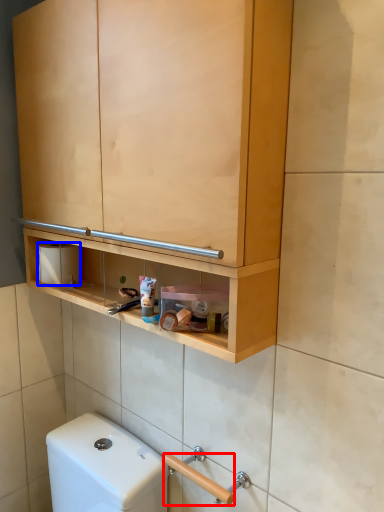
Question: Among these objects, which one is nearest to the camera, door handle (highlighted by a red box) or toilet paper (highlighted by a blue box)?

Choices:
 (A) door handle
 (B) toilet paper

Answer: (A)